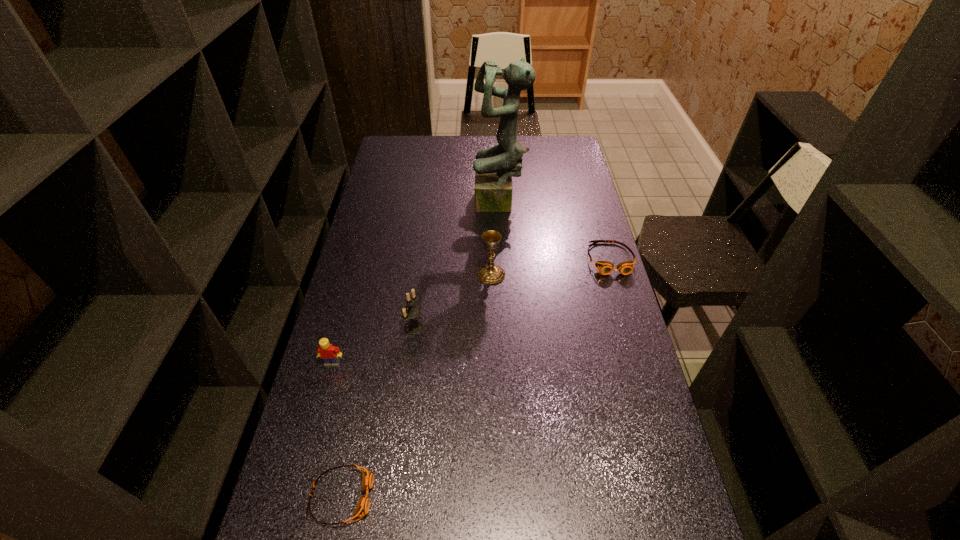
The width and height of the screenshot is (960, 540). Identify the location of the shorter goggles. (362, 508).

Locate an element on the screen. the nearest object is located at coordinates (362, 508).

The width and height of the screenshot is (960, 540). What are the coordinates of `the rightmost object` in the screenshot? It's located at (604, 267).

The image size is (960, 540). In order to click on the farther goggles in this screenshot , I will do `click(604, 267)`.

Where is `the tallest object`? This screenshot has width=960, height=540. the tallest object is located at coordinates (494, 167).

This screenshot has height=540, width=960. I want to click on the farthest object, so pyautogui.click(x=494, y=167).

Find the location of a particular element. This screenshot has width=960, height=540. the third nearest object is located at coordinates (410, 310).

This screenshot has width=960, height=540. What are the coordinates of `candle holder` in the screenshot? It's located at (410, 310).

I want to click on chalice, so click(x=490, y=273).

Where is `the fifth farthest object`? the fifth farthest object is located at coordinates point(330,354).